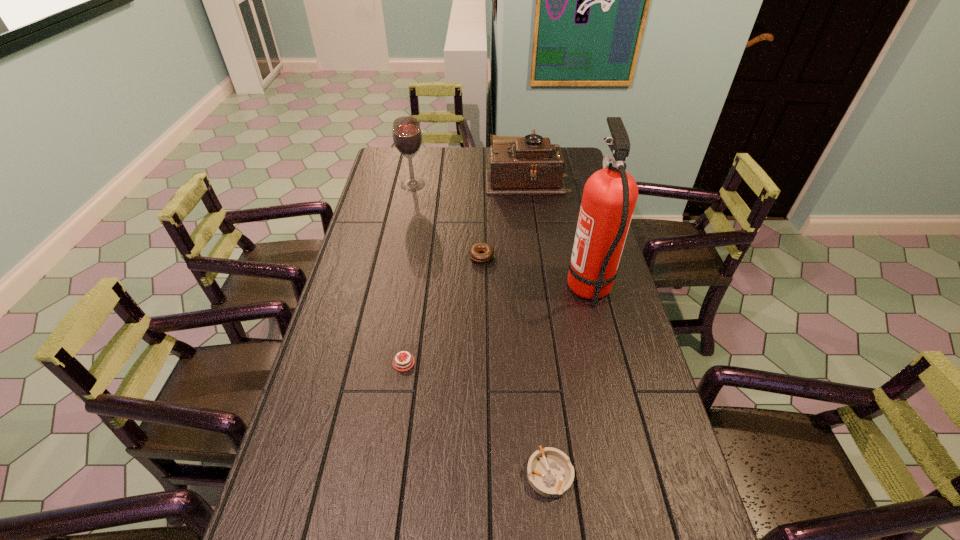
Where is `object located in the far right corner section of the desktop`? object located in the far right corner section of the desktop is located at coordinates (531, 165).

Locate an element on the screen. The width and height of the screenshot is (960, 540). vacant point at the far edge is located at coordinates (483, 156).

This screenshot has width=960, height=540. I want to click on free space at the left edge of the desktop, so click(x=357, y=278).

The height and width of the screenshot is (540, 960). Identify the location of vacant space at the right edge of the desktop. (591, 323).

You are a GUI agent. You are given a task and a screenshot of the screen. Output one action in this format:
    pyautogui.click(x=<x>, y=<y>)
    Task: Click on the vacant area at the far left corner of the desktop
    This screenshot has height=540, width=960.
    Given the screenshot: What is the action you would take?
    pyautogui.click(x=396, y=166)

You are a GUI agent. You are given a task and a screenshot of the screen. Output one action in this format:
    pyautogui.click(x=<x>, y=<y>)
    Task: Click on the vacant space that's between the chocolate cake and the fire extinguisher
    This screenshot has height=540, width=960.
    Given the screenshot: What is the action you would take?
    pyautogui.click(x=496, y=326)

The width and height of the screenshot is (960, 540). I want to click on unoccupied position between the doughnut and the third tallest object, so click(x=504, y=217).

At what (x,y) coordinates should I click in order to perform the action: click on vacant point located between the chocolate cake and the ashtray. Please return your answer as a coordinate pair (x, y). Looking at the image, I should click on (476, 418).

This screenshot has width=960, height=540. I want to click on vacant area that lies between the ashtray and the fire extinguisher, so click(x=569, y=382).

Where is `free space between the tallest object and the alcohol`? The image size is (960, 540). free space between the tallest object and the alcohol is located at coordinates (501, 237).